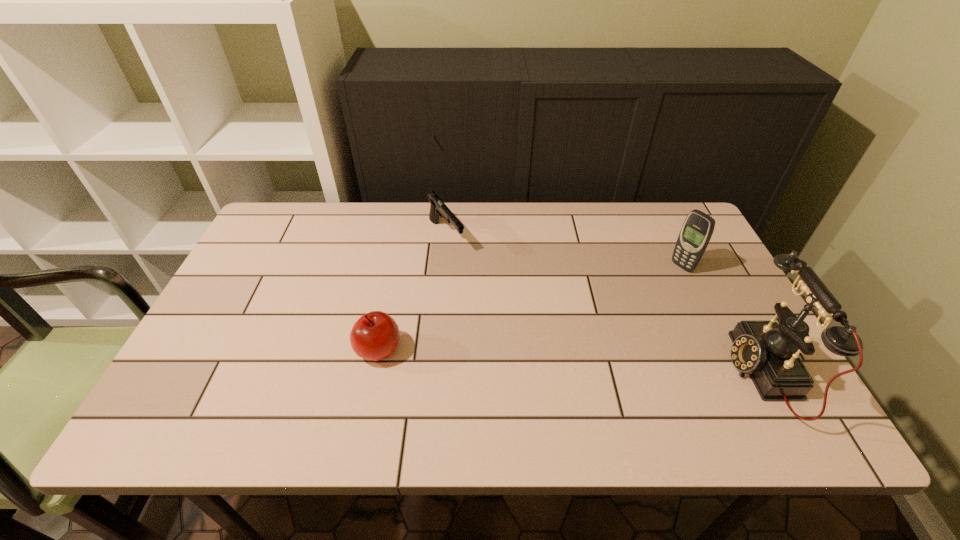
This screenshot has height=540, width=960. I want to click on free spot on the desktop that is between the leftmost object and the tallest object and is positioned on the screen of the second tallest object, so 530,359.

Where is `free space on the desktop that is between the apple and the tallest object and is positioned at the aiming end of the second object from left to right`? free space on the desktop that is between the apple and the tallest object and is positioned at the aiming end of the second object from left to right is located at coordinates (546, 360).